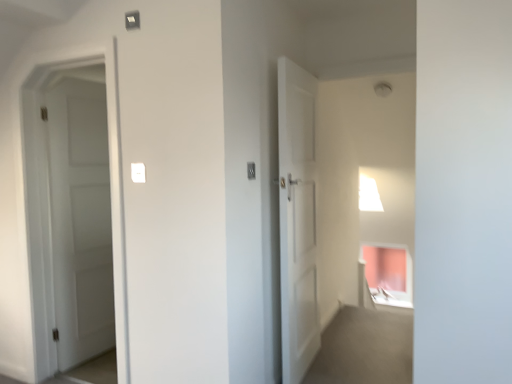
Question: Relative to white matte door at left, is white plastic light switch at center, the 1th light switch positioned from the left, in front or behind?

Choices:
 (A) front
 (B) behind

Answer: (A)

Question: Based on their sizes in the image, would you say white plastic light switch at center, the second light switch when ordered from right to left, is bigger or smaller than white matte door at left?

Choices:
 (A) small
 (B) big

Answer: (A)

Question: Estimate the real-world distances between objects in this image. Which object is farther from the white plastic light switch at center, the 1th light switch positioned from the left?

Choices:
 (A) white matte door at left
 (B) white plastic light switch at center, the second light switch when ordered from left to right

Answer: (A)

Question: Which object is positioned closest to the white plastic light switch at center, the second light switch when ordered from right to left?

Choices:
 (A) white matte door at left
 (B) white plastic light switch at center, marked as the 1th light switch in a right-to-left arrangement

Answer: (B)